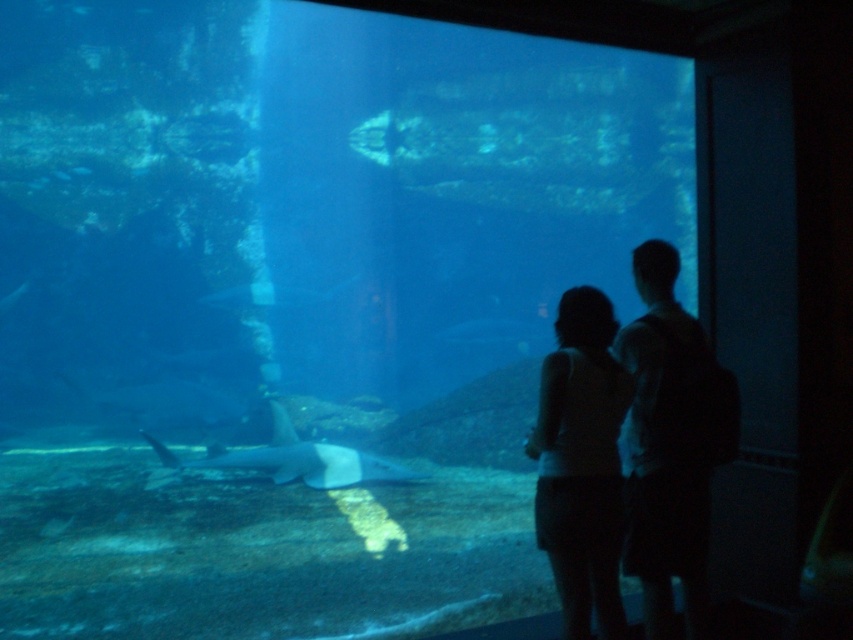
Question: Can you confirm if silhouette human at center is positioned to the right of silhouette fabric at center?

Choices:
 (A) yes
 (B) no

Answer: (A)

Question: Does silhouette human at center have a larger size compared to silhouette fabric at center?

Choices:
 (A) no
 (B) yes

Answer: (B)

Question: Among these objects, which one is nearest to the camera?

Choices:
 (A) silhouette human at center
 (B) silhouette fabric at center

Answer: (B)

Question: Does silhouette human at center have a smaller size compared to silhouette fabric at center?

Choices:
 (A) no
 (B) yes

Answer: (A)

Question: Which point appears closest to the camera in this image?

Choices:
 (A) (567, 435)
 (B) (703, 490)

Answer: (A)